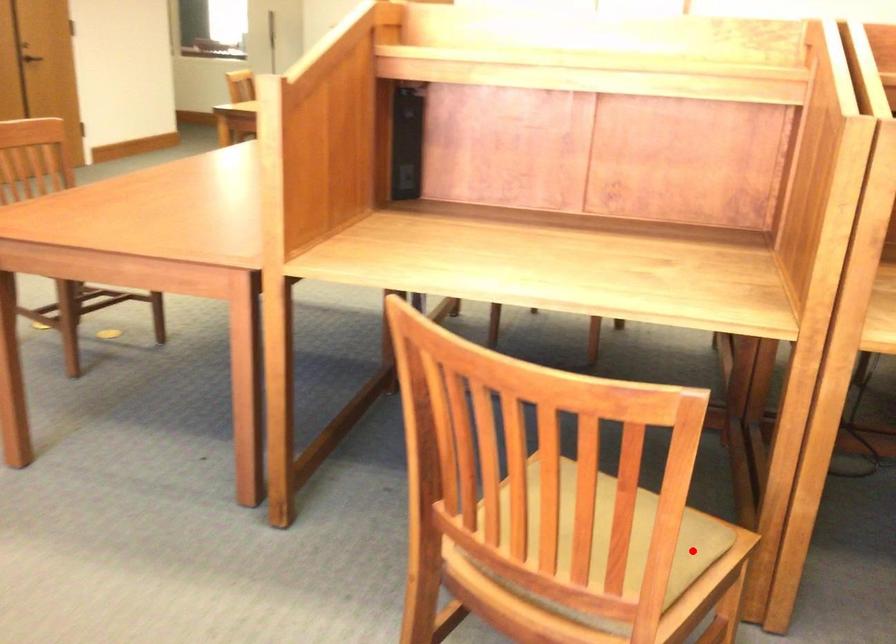
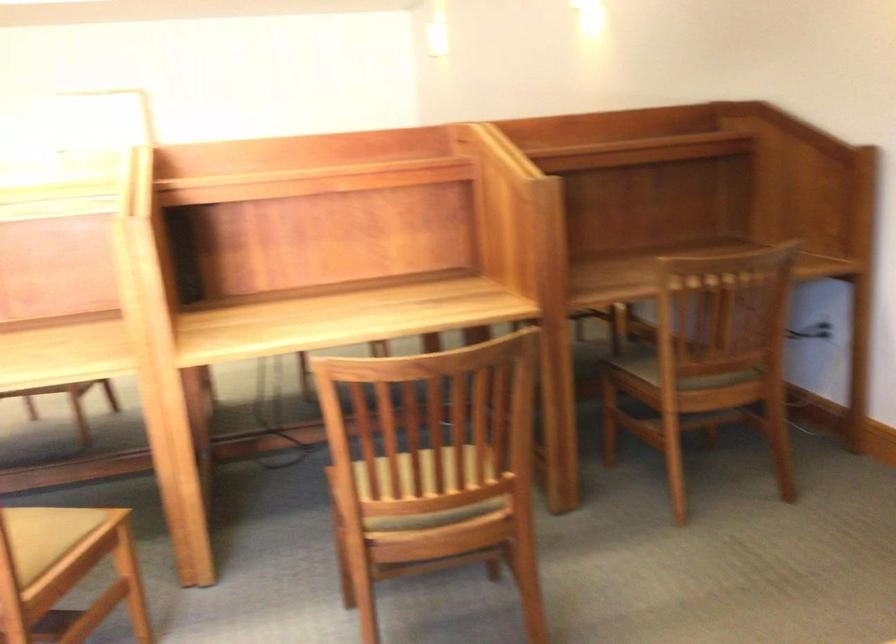
Question: I am providing you with two images of the same scene from different viewpoints. A red point is shown in image1. For the corresponding object point in image2, is it positioned nearer or farther from the camera?

Choices:
 (A) Nearer
 (B) Farther

Answer: (B)